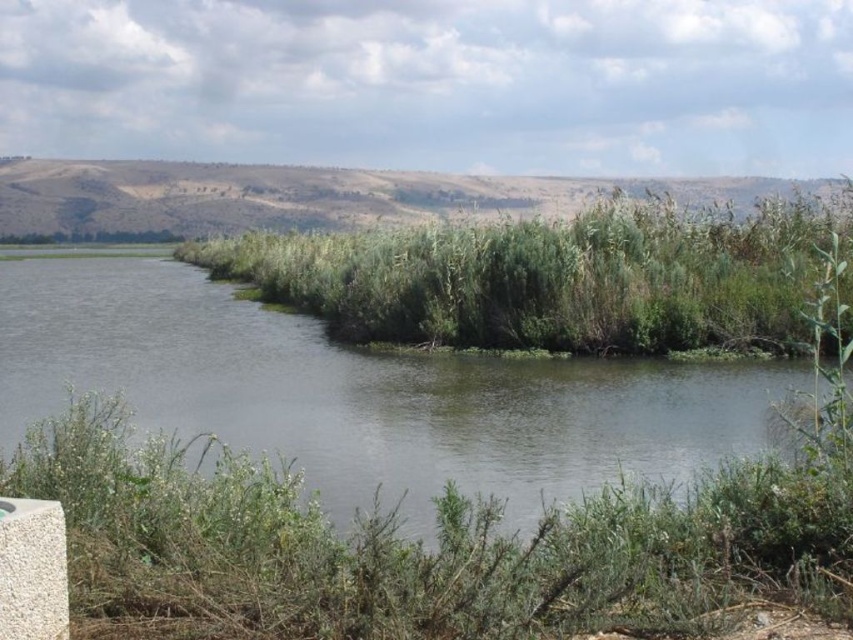
You are a hiker trying to cross the green grassy river at center. There is a path through the green leafy shrubs at lower center. Since the shrubs are smaller than the river, can you use the shrub path to cross the river?

The green leafy shrubs at lower center occupies less space than green grassy river at center, so the path through the green leafy shrubs at lower center may not be wide enough to cross the entire green grassy river at center. You might need to find another route.

You are standing at the origin point of the coordinate system in the scene. You need to locate the green leafy shrubs at lower center. What are their coordinates?

The green leafy shrubs at lower center are located at coordinates point (421, 547).